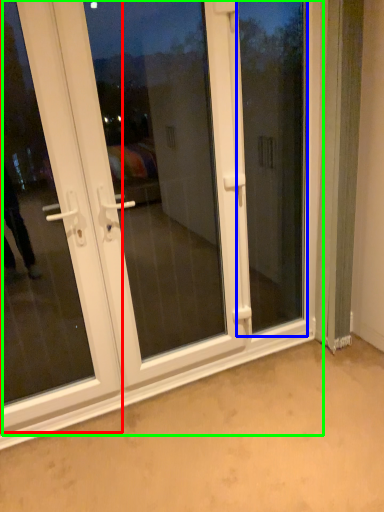
Question: Which object is the closest to the door (highlighted by a red box)? Choose among these: window screen (highlighted by a blue box) or door (highlighted by a green box).

Choices:
 (A) window screen
 (B) door

Answer: (B)